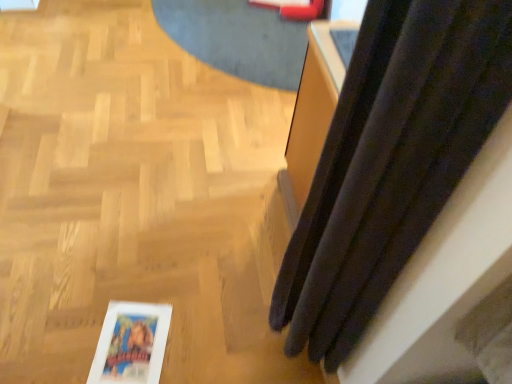
You are a GUI agent. You are given a task and a screenshot of the screen. Output one action in this format:
    pyautogui.click(x=<x>, y=<y>)
    Task: Click on the free area behind white glossy magazine at lower left
    
    Given the screenshot: What is the action you would take?
    pyautogui.click(x=150, y=282)